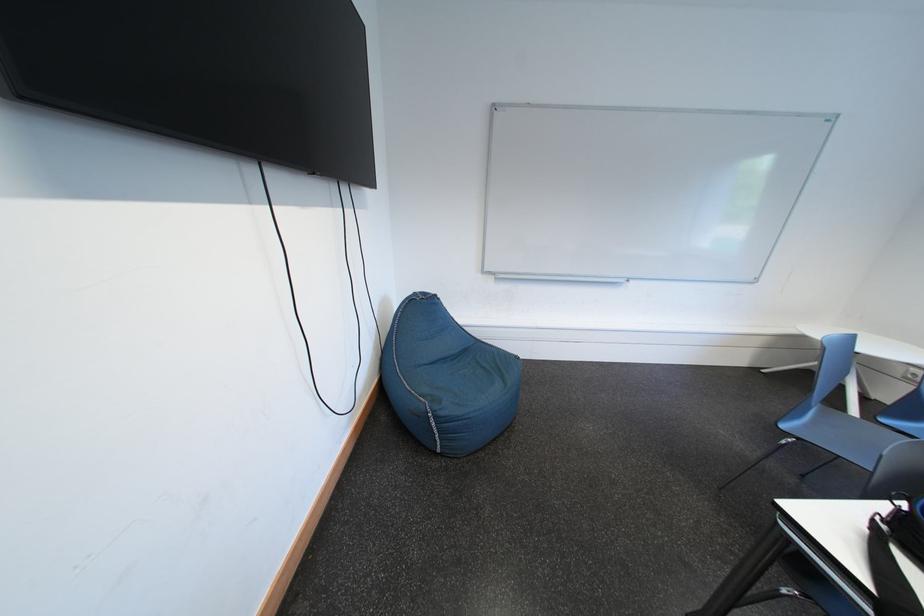
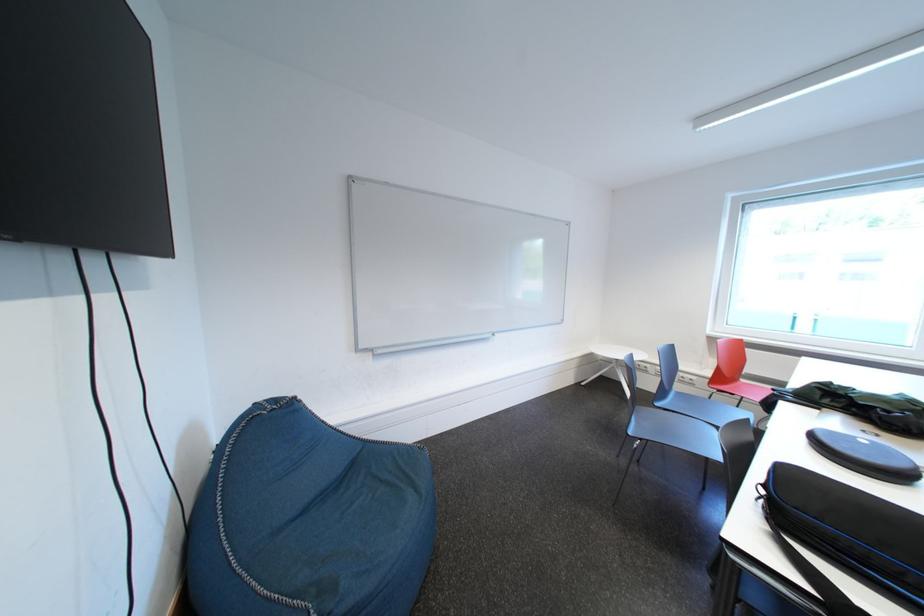
The point at (792, 431) is marked in the first image. Where is the corresponding point in the second image?

(639, 437)